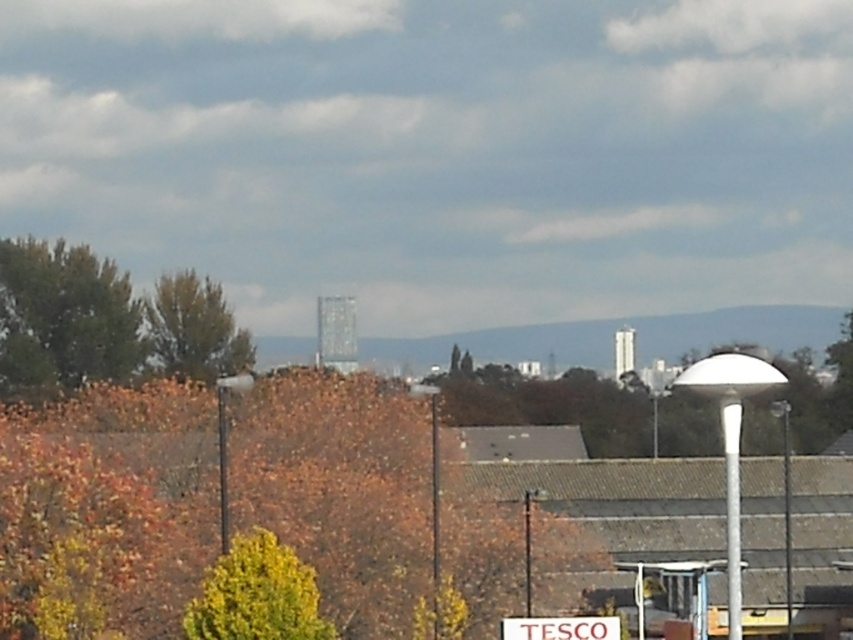
Question: Which point is closer to the camera taking this photo?

Choices:
 (A) (0, 248)
 (B) (244, 608)
 (C) (161, 323)
 (D) (405, 467)

Answer: (B)

Question: Does orange autumn leaves at lower left appear on the left side of green leafy tree at upper left?

Choices:
 (A) yes
 (B) no

Answer: (B)

Question: Can you confirm if orange autumn leaves at lower left is positioned to the right of green leafy tree at lower left?

Choices:
 (A) no
 (B) yes

Answer: (A)

Question: Does green leafy tree at left have a lesser width compared to green leafy tree at lower left?

Choices:
 (A) no
 (B) yes

Answer: (A)

Question: Which point appears closest to the camera in this image?

Choices:
 (A) (413, 540)
 (B) (82, 300)
 (C) (200, 317)
 (D) (212, 595)

Answer: (D)

Question: Which of the following is the closest to the observer?

Choices:
 (A) (120, 276)
 (B) (192, 394)
 (C) (186, 364)

Answer: (B)